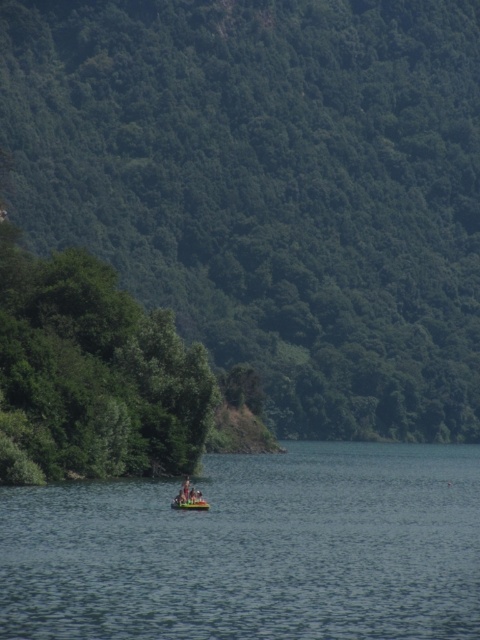
Question: Which of these objects is positioned farthest from the green leafy tree at center-left?

Choices:
 (A) green leafy tree at left
 (B) yellow rubber boat at center
 (C) clear blue water at center

Answer: (B)

Question: Does clear blue water at center appear on the right side of yellow rubber boat at center?

Choices:
 (A) yes
 (B) no

Answer: (A)

Question: Does green leafy tree at center-left appear under green leafy tree at left?

Choices:
 (A) yes
 (B) no

Answer: (B)

Question: Which object appears closest to the camera in this image?

Choices:
 (A) yellow rubber boat at center
 (B) clear blue water at center
 (C) green leafy tree at center-left
 (D) green leafy tree at left

Answer: (B)

Question: Which of the following is the farthest from the observer?

Choices:
 (A) yellow rubber boat at center
 (B) green leafy tree at center-left
 (C) green leafy tree at left

Answer: (B)

Question: Can you confirm if clear blue water at center is smaller than yellow rubber boat at center?

Choices:
 (A) no
 (B) yes

Answer: (A)